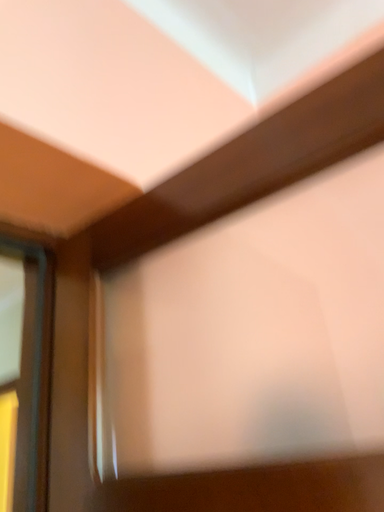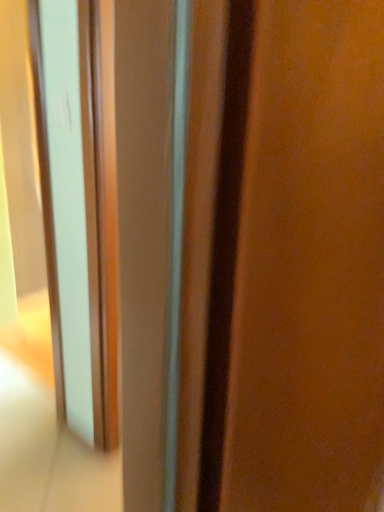
Question: How did the camera likely rotate when shooting the video?

Choices:
 (A) rotated upward
 (B) rotated downward

Answer: (B)